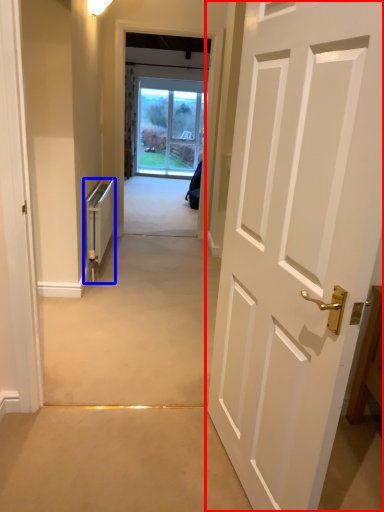
Question: Which object is closer to the camera taking this photo, door (highlighted by a red box) or appliance (highlighted by a blue box)?

Choices:
 (A) door
 (B) appliance

Answer: (A)